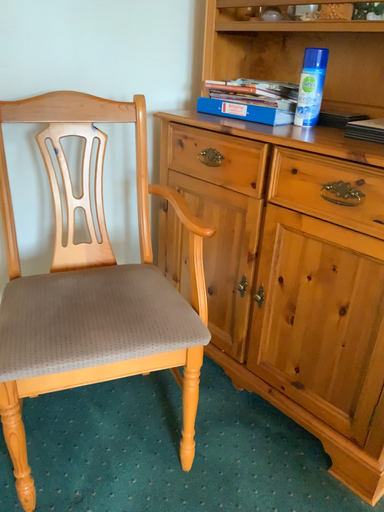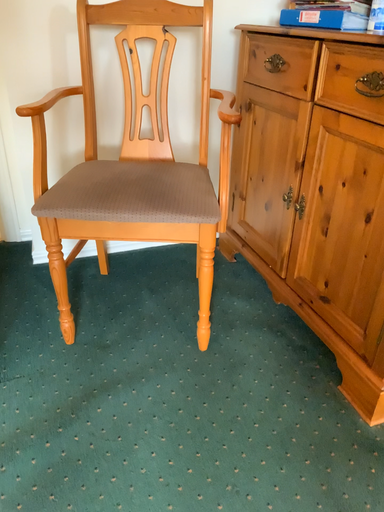
Question: How did the camera likely rotate when shooting the video?

Choices:
 (A) rotated right
 (B) rotated left

Answer: (B)